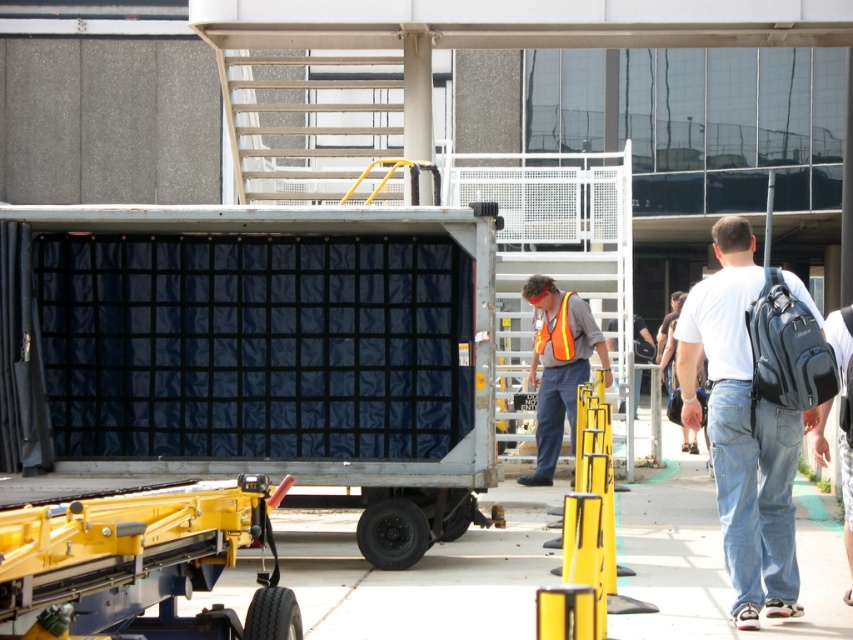
You are a security guard at the airport and need to check the reflective orange safety vest at center and the denim jeans at right. Which one is located to the right of the other?

The denim jeans at right is positioned on the right side of reflective orange safety vest at center, so the denim jeans at right is to the right of the reflective orange safety vest at center.

You are a delivery driver who needs to load a package onto the cargo container in the image. The package requires a clear path to the container. Is the path between the denim jeans at right and the reflective orange safety vest at center wide enough for a 0.5 meter wide forklift?

The denim jeans at right is thinner than the reflective orange safety vest at center. However, the exact width of the path between them isn not specified in the provided description. Without specific measurements, it is impossible to determine if the path is wide enough for a 0.5 meter wide forklift.

You are a security guard at the airport and need to determine if the person in the denim jeans at right can hide behind the reflective orange safety vest at center without being seen. Based on their heights, is this possible?

The denim jeans at right has a lesser height compared to the reflective orange safety vest at center, so the person in denim jeans at right cannot hide behind the reflective orange safety vest at center because they are shorter.